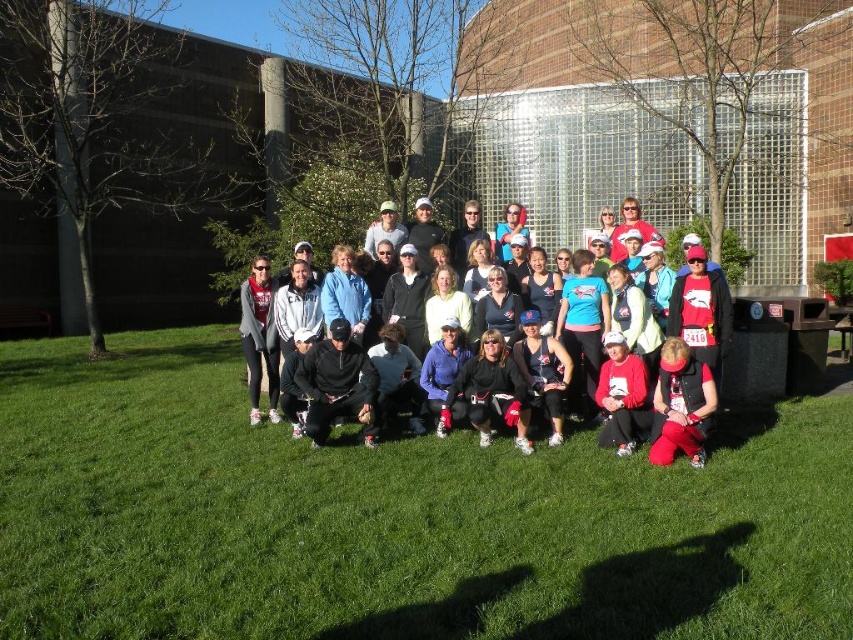
You are a photographer taking a picture of the group. You notice a point at coordinates [657,397]. What is located at that point?

The point at coordinates [657,397] has solid white shirts at center.

You are standing at the edge of the grassy area and want to place a small flag exactly at the center of the green grass at center. According to the coordinates provided, where should you place the flag?

The green grass at center is located at point (393, 518), so you should place the flag at coordinates (393, 518) to mark its center.